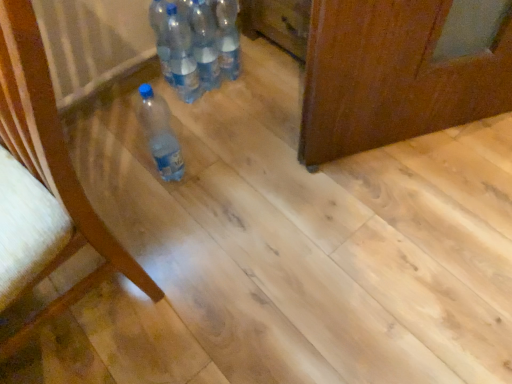
Question: Based on their positions, is matte wood chair at left located to the left or right of translucent plastic bottle at lower left, marked as the 1th bottle in a bottom-to-top arrangement?

Choices:
 (A) right
 (B) left

Answer: (B)

Question: From the image's perspective, is matte wood chair at left positioned above or below translucent plastic bottle at lower left, marked as the 1th bottle in a bottom-to-top arrangement?

Choices:
 (A) above
 (B) below

Answer: (B)

Question: Estimate the real-world distances between objects in this image. Which object is closer to the translucent plastic bottle at lower left, which is counted as the 4th bottle, starting from the top?

Choices:
 (A) clear plastic bottle at center, which is counted as the second bottle, starting from the bottom
 (B) translucent plastic bottle at center, the fourth bottle when ordered from bottom to top
 (C) translucent plastic bottles at center, the third bottle positioned from the bottom
 (D) matte wood chair at left

Answer: (A)

Question: Based on their relative distances, which object is nearer to the clear plastic bottle at center, which is counted as the second bottle, starting from the bottom?

Choices:
 (A) translucent plastic bottle at lower left, marked as the 1th bottle in a bottom-to-top arrangement
 (B) translucent plastic bottles at center, the third bottle positioned from the bottom
 (C) translucent plastic bottle at center, marked as the 1th bottle in a top-to-bottom arrangement
 (D) matte wood chair at left

Answer: (B)